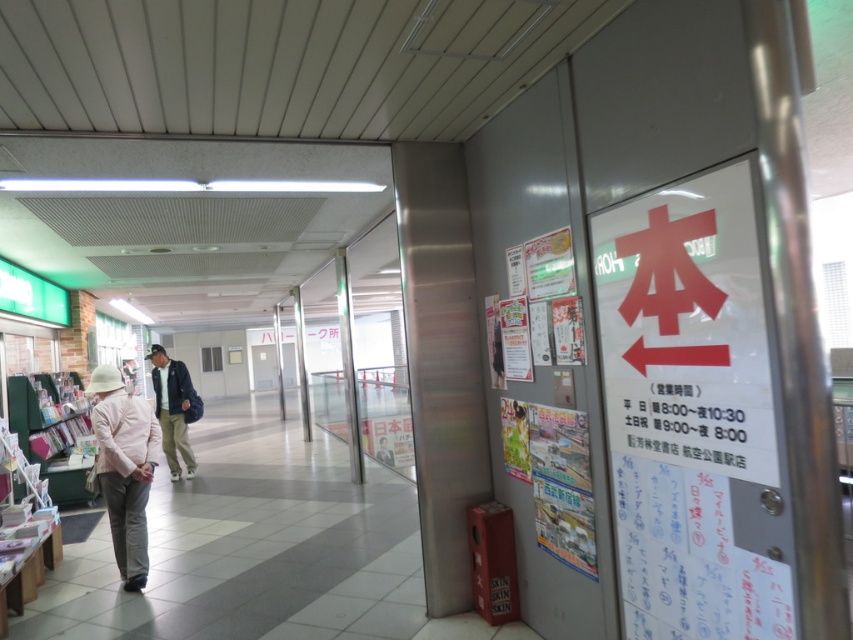
You are standing at the entrance of the bookstore and want to take a photo of the point at coordinates (123, 582). If your camera has a focal length of 50mm and you are 13.86 feet away from the point, what is the required distance in millimeters between the camera lens and the image sensor to capture the point clearly?

The required distance between the camera lens and the image sensor to capture the point clearly is 50mm, as this is the focal length provided.

You are a customer entering the bookstore and see the light pink fabric hat at left and the matte khaki pants at center. Which object is closer to you as you enter?

The light pink fabric hat at left is closer to you because it is in front of the matte khaki pants at center.